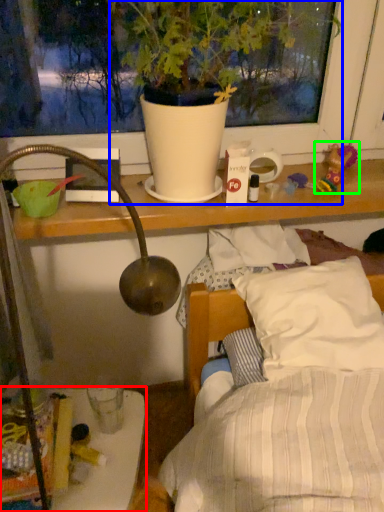
Question: Which object is the closest to the furniture (highlighted by a red box)? Choose among these: houseplant (highlighted by a blue box) or toy (highlighted by a green box).

Choices:
 (A) houseplant
 (B) toy

Answer: (A)